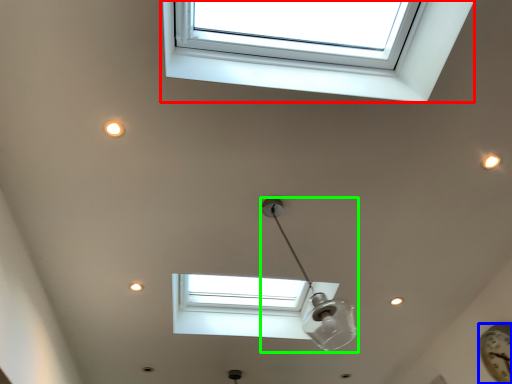
Question: Which object is positioned farthest from window (highlighted by a red box)? Select from clock (highlighted by a blue box) and lamp (highlighted by a green box).

Choices:
 (A) clock
 (B) lamp

Answer: (A)